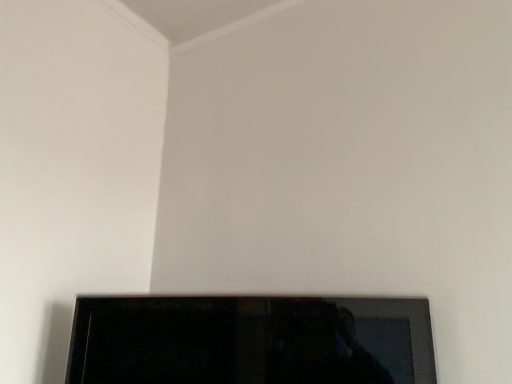
I want to click on black glossy tv at bottom, so click(x=251, y=340).

Describe the element at coordinates (251, 340) in the screenshot. The width and height of the screenshot is (512, 384). I see `black glossy tv at bottom` at that location.

Identify the location of black glossy tv at bottom. click(x=251, y=340).